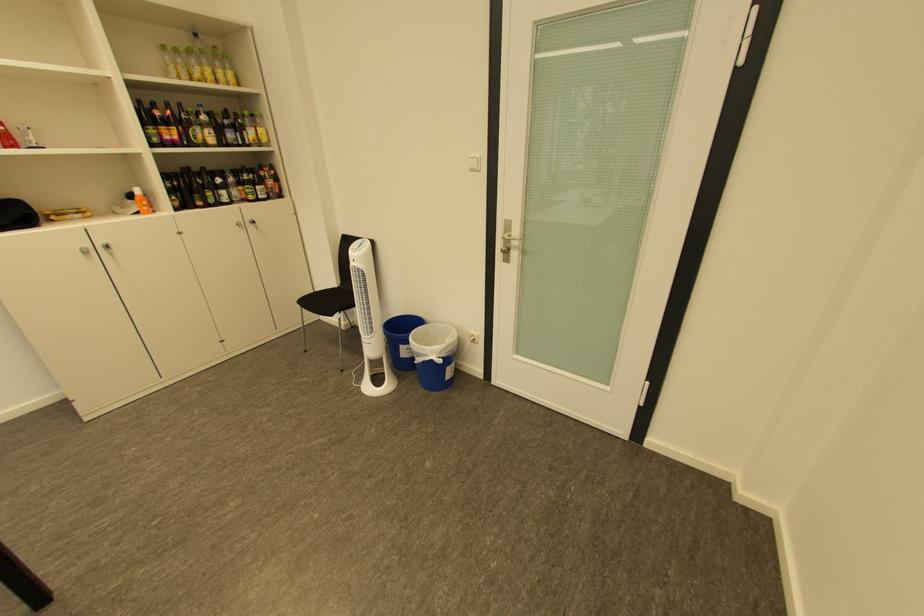
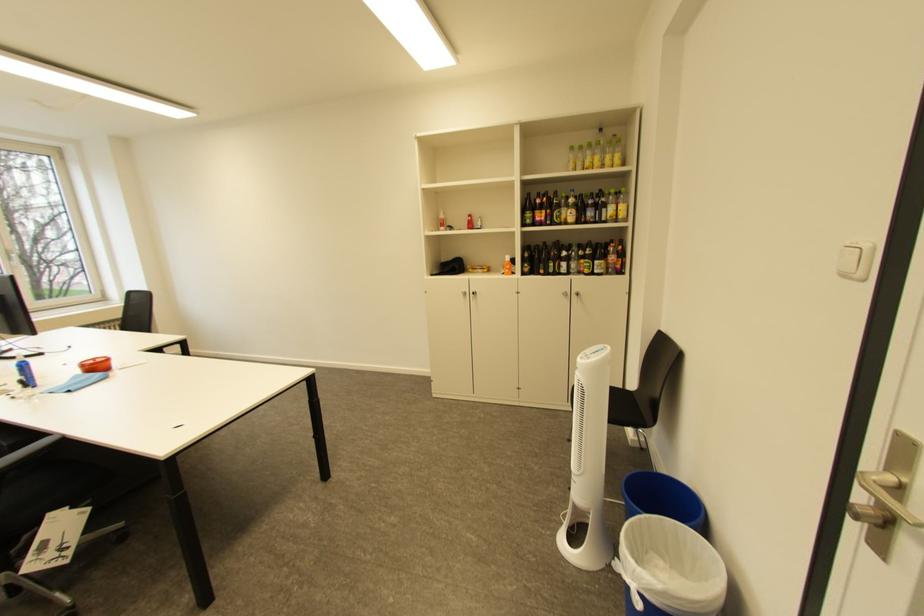
Find the pixel in the second image that matches pixel 248 130 in the first image.

(610, 208)